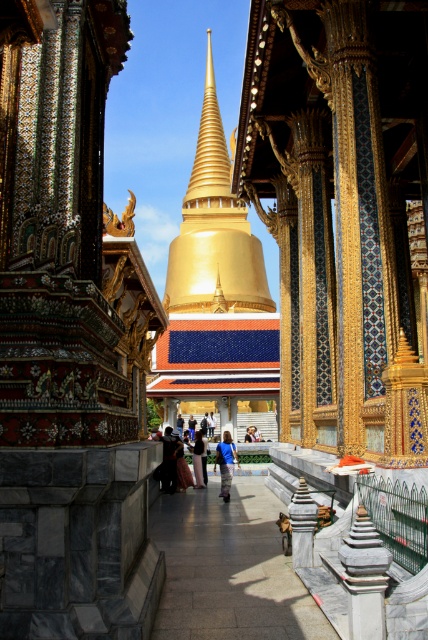
Question: Which point is farther from the camera taking this photo?

Choices:
 (A) (229, 480)
 (B) (201, 442)
 (C) (193, 433)

Answer: (C)

Question: Is black velvet dress at center above blue fabric person at center?

Choices:
 (A) yes
 (B) no

Answer: (A)

Question: Which point is closer to the camera?

Choices:
 (A) blue fabric person at center
 (B) black velvet dress at center

Answer: (B)

Question: Does black velvet dress at center have a lesser width compared to blue fabric bag at center?

Choices:
 (A) no
 (B) yes

Answer: (A)

Question: Based on their relative distances, which object is nearer to the blue fabric bag at center?

Choices:
 (A) blue denim jeans at center
 (B) black velvet dress at center

Answer: (A)

Question: Observing the image, what is the correct spatial positioning of gold polished spire at center in reference to blue fabric person at center?

Choices:
 (A) right
 (B) left

Answer: (B)